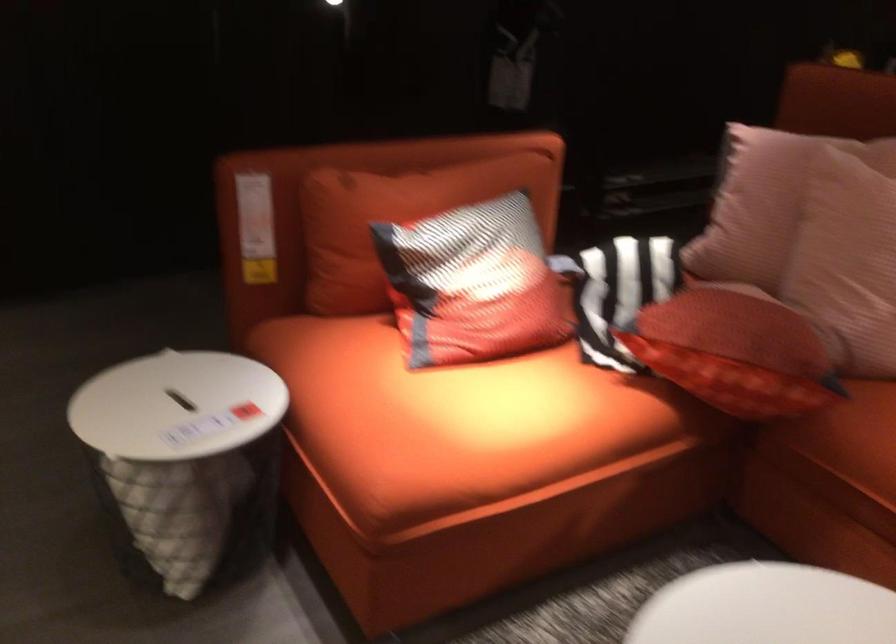
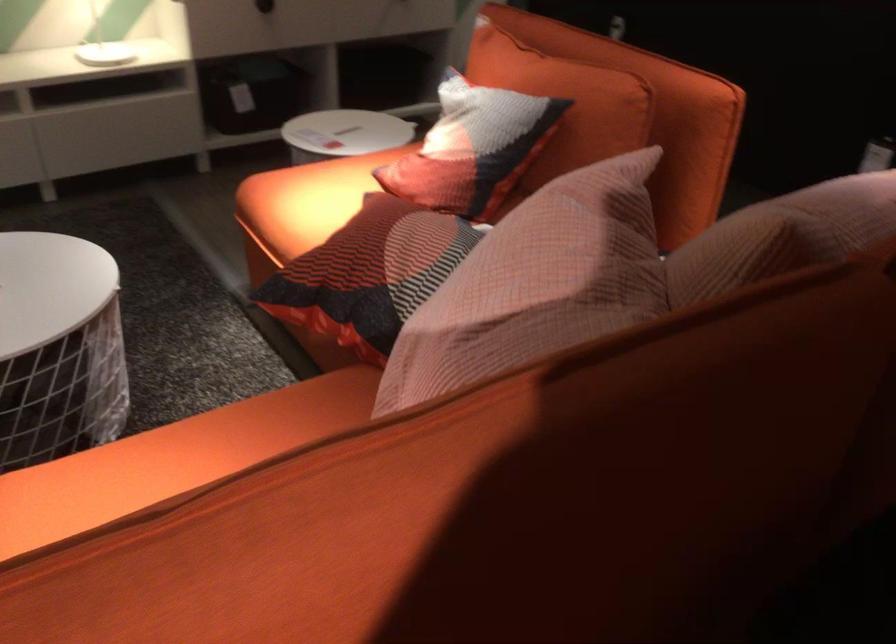
In the second image, find the point that corresponds to point 522,193 in the first image.

(564, 102)